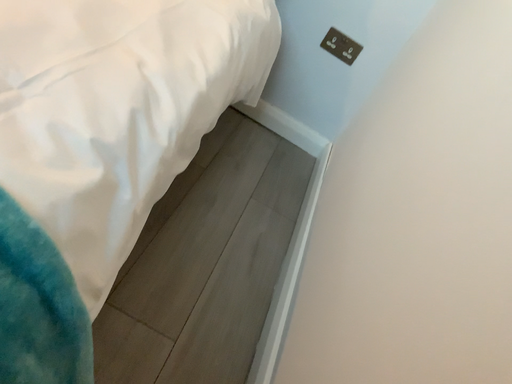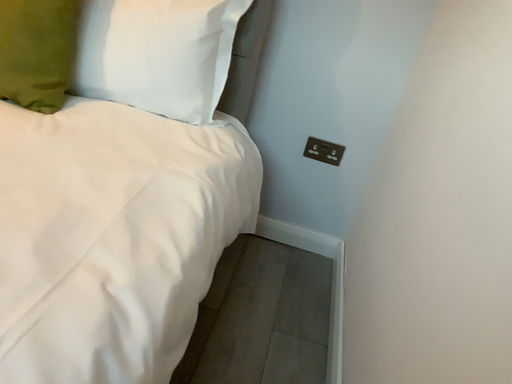
Question: How did the camera likely rotate when shooting the video?

Choices:
 (A) rotated upward
 (B) rotated downward

Answer: (A)